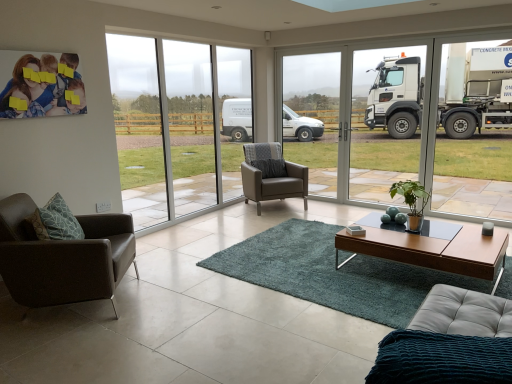
Question: From the image's perspective, is teal shaggy rug at center under leather armchair at center, the 1th chair positioned from the back?

Choices:
 (A) no
 (B) yes

Answer: (B)

Question: From the image's perspective, does teal shaggy rug at center appear higher than leather armchair at center, which appears as the 1th chair when viewed from the right?

Choices:
 (A) yes
 (B) no

Answer: (B)

Question: Is teal shaggy rug at center to the right of leather armchair at center, which appears as the 1th chair when viewed from the right, from the viewer's perspective?

Choices:
 (A) yes
 (B) no

Answer: (A)

Question: Can you confirm if teal shaggy rug at center is shorter than leather armchair at center, which ranks as the second chair in left-to-right order?

Choices:
 (A) yes
 (B) no

Answer: (A)

Question: Does teal shaggy rug at center turn towards leather armchair at center, the 1th chair positioned from the back?

Choices:
 (A) no
 (B) yes

Answer: (A)

Question: Which is correct: transparent glass window at center is inside green matte plant at center, or outside of it?

Choices:
 (A) outside
 (B) inside

Answer: (A)

Question: Considering the positions of transparent glass window at center and green matte plant at center in the image, is transparent glass window at center bigger or smaller than green matte plant at center?

Choices:
 (A) big
 (B) small

Answer: (A)

Question: Would you say transparent glass window at center is to the left or to the right of green matte plant at center in the picture?

Choices:
 (A) left
 (B) right

Answer: (A)

Question: From a real-world perspective, relative to green matte plant at center, is transparent glass window at center vertically above or below?

Choices:
 (A) above
 (B) below

Answer: (A)

Question: From their relative heights in the image, would you say brown leather chair at lower left, which is the 1th chair in left-to-right order, is taller or shorter than leather studio couch at lower right?

Choices:
 (A) tall
 (B) short

Answer: (A)

Question: Is brown leather chair at lower left, which is the 1th chair in left-to-right order, spatially inside leather studio couch at lower right, or outside of it?

Choices:
 (A) inside
 (B) outside

Answer: (B)

Question: Looking at the image, does brown leather chair at lower left, which is the 1th chair in left-to-right order, seem bigger or smaller compared to leather studio couch at lower right?

Choices:
 (A) small
 (B) big

Answer: (B)

Question: Is point (62, 289) closer or farther from the camera than point (425, 327)?

Choices:
 (A) farther
 (B) closer

Answer: (A)

Question: From a real-world perspective, is wooden glossy coffee table at center above or below leather armchair at center, which appears as the 1th chair when viewed from the right?

Choices:
 (A) below
 (B) above

Answer: (A)

Question: In terms of size, does wooden glossy coffee table at center appear bigger or smaller than leather armchair at center, positioned as the 2th chair in front-to-back order?

Choices:
 (A) small
 (B) big

Answer: (A)